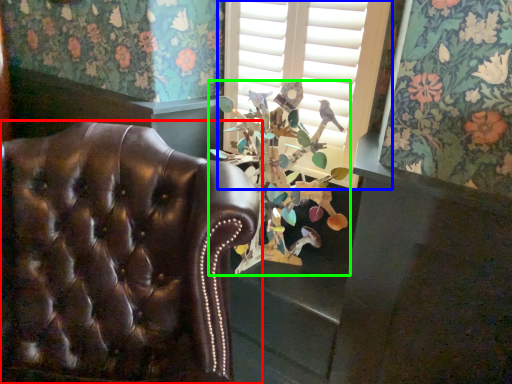
Question: Which is farther away from chair (highlighted by a red box)? window (highlighted by a blue box) or floral arrangement (highlighted by a green box)?

Choices:
 (A) window
 (B) floral arrangement

Answer: (A)